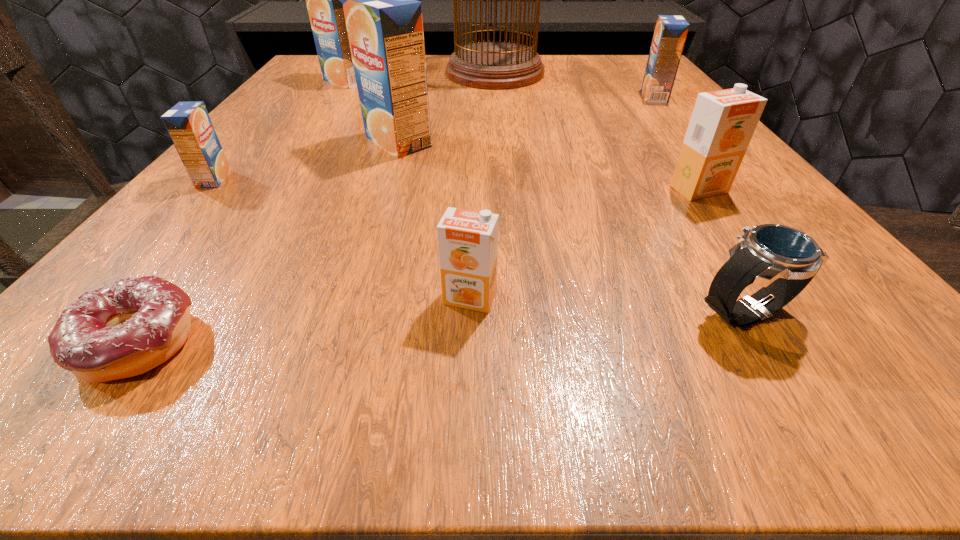
Where is `doughnut situated at the near edge`? This screenshot has width=960, height=540. doughnut situated at the near edge is located at coordinates [124, 329].

Locate an element on the screen. doughnut present at the left edge is located at coordinates (124, 329).

The image size is (960, 540). Identify the location of watch that is at the right edge. (783, 260).

Image resolution: width=960 pixels, height=540 pixels. Find the location of `object positioned at the far left corner`. object positioned at the far left corner is located at coordinates (324, 0).

Where is `object situated at the near left corner`? The height and width of the screenshot is (540, 960). object situated at the near left corner is located at coordinates click(124, 329).

Identify the location of object at the near right corner. (783, 260).

You are a GUI agent. You are given a task and a screenshot of the screen. Output one action in this format:
    pyautogui.click(x=<x>, y=<y>)
    Task: Click on the free space at the far edge of the desktop
    The width and height of the screenshot is (960, 540).
    Given the screenshot: What is the action you would take?
    pyautogui.click(x=551, y=62)

Find the location of a particular element. vacant space at the near edge of the desktop is located at coordinates (543, 383).

Image resolution: width=960 pixels, height=540 pixels. Identify the location of vacant space at the left edge. (275, 193).

You are a GUI agent. You are given a task and a screenshot of the screen. Output one action in this format:
    pyautogui.click(x=<x>, y=<y>)
    Task: Click on the free region at the right edge of the desktop
    
    Given the screenshot: What is the action you would take?
    pyautogui.click(x=633, y=95)